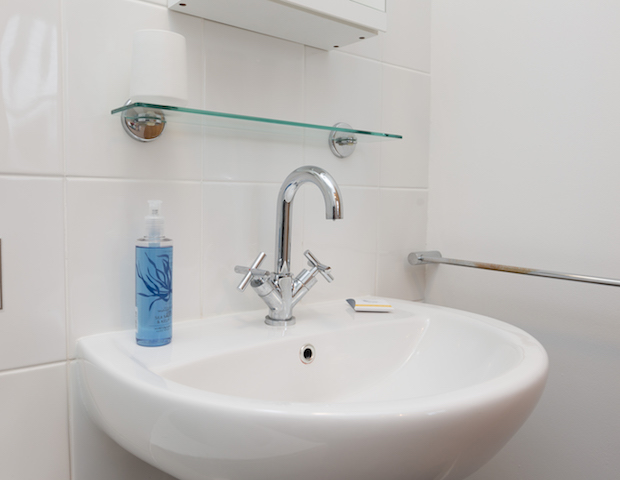
Where is `faucet`? The image size is (620, 480). faucet is located at coordinates (330, 193).